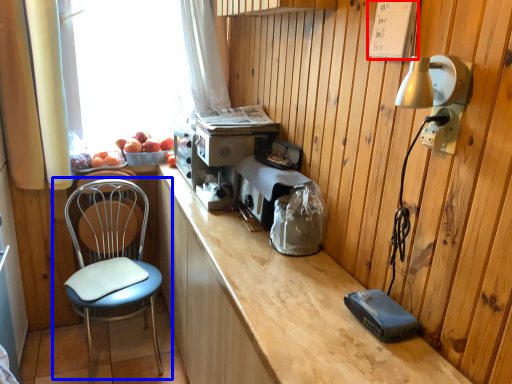
Question: Among these objects, which one is farthest to the camera, panel (highlighted by a red box) or chair (highlighted by a blue box)?

Choices:
 (A) panel
 (B) chair

Answer: (B)